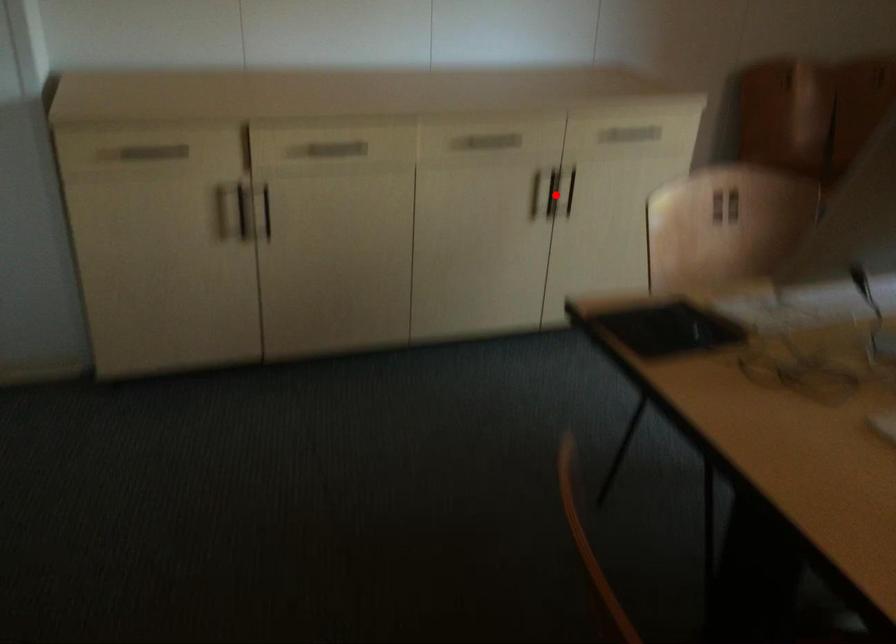
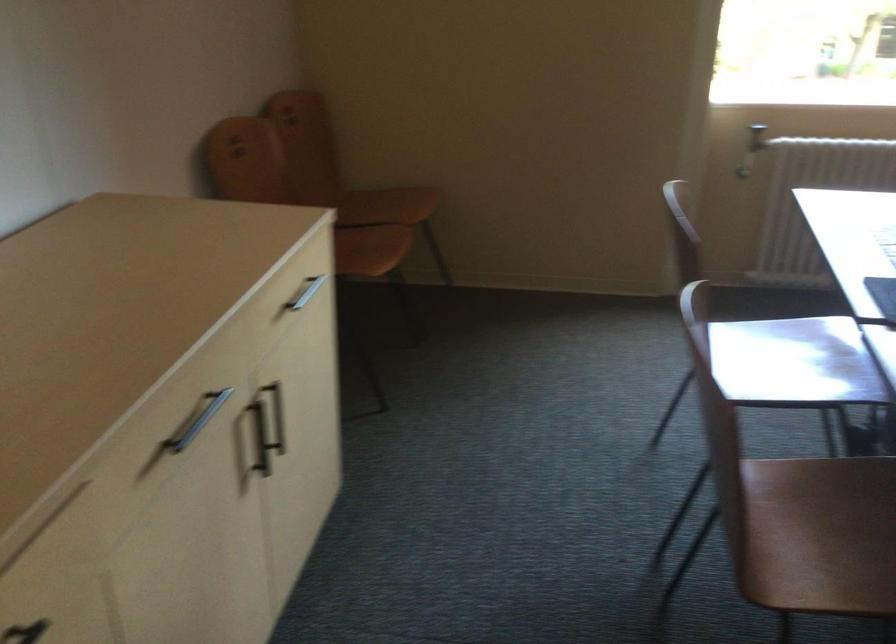
Question: I am providing you with two images of the same scene from different viewpoints. In image1, a red point is highlighted. Considering the same 3D point in image2, which of the following is correct?

Choices:
 (A) It is closer
 (B) It is farther

Answer: (A)